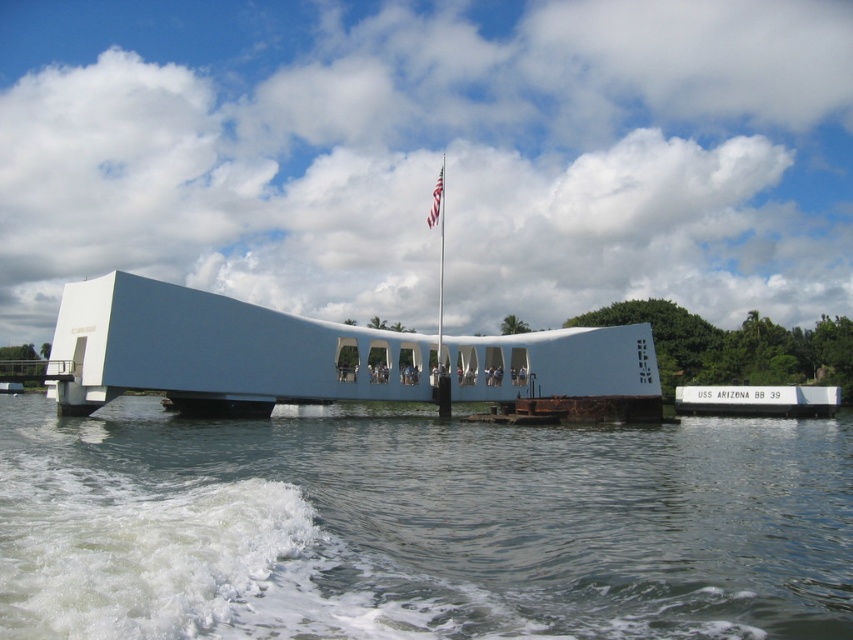
Question: Can you confirm if white concrete dock at center is positioned to the right of white fabric flag at center?

Choices:
 (A) no
 (B) yes

Answer: (B)

Question: Which object appears closest to the camera in this image?

Choices:
 (A) white fabric flag at center
 (B) clear water at lower center
 (C) white concrete dock at center

Answer: (B)

Question: Does white smooth memorial at center appear over white concrete dock at center?

Choices:
 (A) yes
 (B) no

Answer: (A)

Question: Estimate the real-world distances between objects in this image. Which object is farther from the white smooth memorial at center?

Choices:
 (A) white concrete dock at center
 (B) white fabric flag at center

Answer: (A)

Question: Is white smooth memorial at center above white fabric flag at center?

Choices:
 (A) no
 (B) yes

Answer: (A)

Question: Among these objects, which one is nearest to the camera?

Choices:
 (A) white smooth memorial at center
 (B) clear water at lower center
 (C) white concrete dock at center
 (D) white fabric flag at center

Answer: (B)